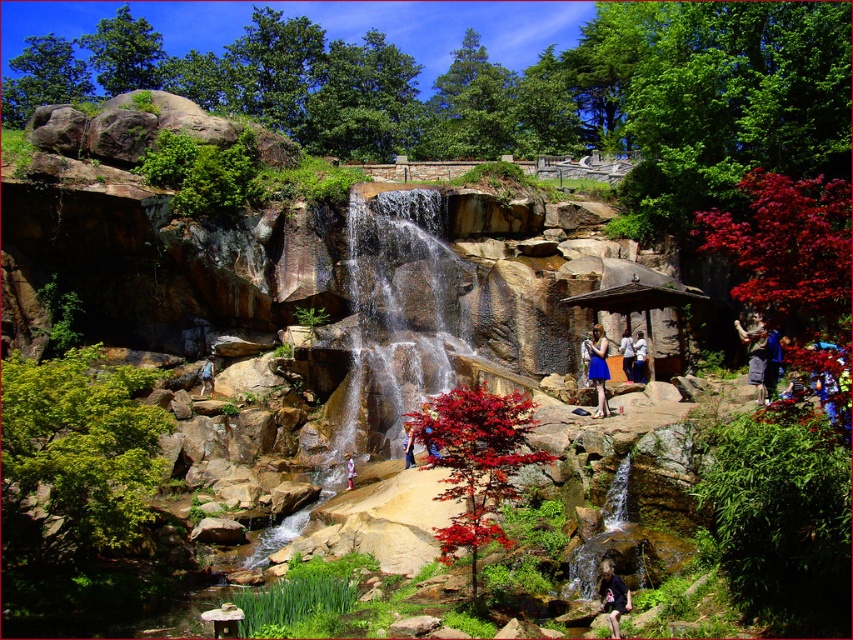
Question: Which object is farther from the camera taking this photo?

Choices:
 (A) light brown fabric backpack at left
 (B) white cotton shirt at center
 (C) blue denim shorts at center

Answer: (A)

Question: Which object appears closest to the camera in this image?

Choices:
 (A) matte red tree at center
 (B) blue denim shorts at center
 (C) light brown fabric backpack at left
 (D) black fabric person at lower right

Answer: (D)

Question: Is light brown fabric backpack at left to the right of blue denim shorts at center from the viewer's perspective?

Choices:
 (A) no
 (B) yes

Answer: (A)

Question: Can you confirm if smooth stone waterfall at center is bigger than white cotton shirt at center?

Choices:
 (A) yes
 (B) no

Answer: (A)

Question: Which is farther from the pink fabric dress at center?

Choices:
 (A) blue satin dress at center
 (B) blue fabric dress at center

Answer: (B)

Question: Does black fabric person at lower right have a smaller size compared to blue fabric dress at center?

Choices:
 (A) no
 (B) yes

Answer: (B)